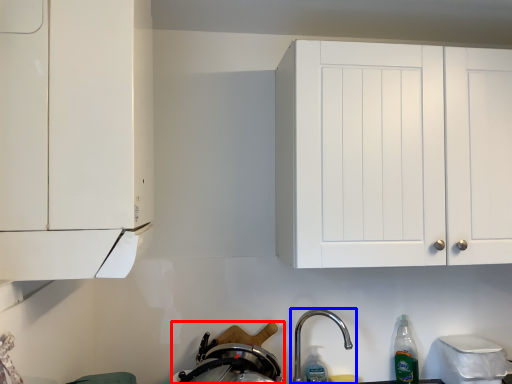
Question: Which object is further to the camera taking this photo, appliance (highlighted by a red box) or tap (highlighted by a blue box)?

Choices:
 (A) appliance
 (B) tap

Answer: (A)